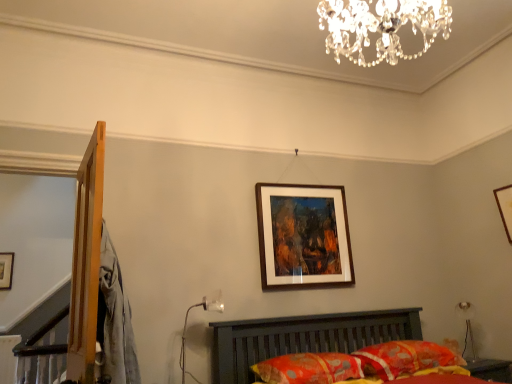
What do you see at coordinates (309, 368) in the screenshot? I see `floral fabric pillow at lower center, the 2th pillow in the right-to-left sequence` at bounding box center [309, 368].

The image size is (512, 384). I want to click on wooden picture frame at upper right, the 2th picture frame viewed from the back, so click(x=505, y=208).

Identify the location of wooden-framed painting at center, which ranks as the second picture frame in right-to-left order. Image resolution: width=512 pixels, height=384 pixels. (303, 235).

The width and height of the screenshot is (512, 384). Find the location of `metallic glass table lamp at lower center, which is the second table lamp from right to left`. metallic glass table lamp at lower center, which is the second table lamp from right to left is located at coordinates (205, 310).

Where is `wooden picture frame at upper center, the 3th picture frame in the front-to-back sequence`? wooden picture frame at upper center, the 3th picture frame in the front-to-back sequence is located at coordinates click(6, 270).

Is point (463, 350) closer to camera compared to point (5, 280)?

Yes, point (463, 350) is in front of point (5, 280).

Considering the relative positions of metallic silver table lamp at lower right, the first table lamp when ordered from back to front, and wooden picture frame at upper center, which ranks as the third picture frame in right-to-left order, in the image provided, is metallic silver table lamp at lower right, the first table lamp when ordered from back to front, in front of wooden picture frame at upper center, which ranks as the third picture frame in right-to-left order,?

Yes, it is.

Locate an element on the screen. the 2nd table lamp directly beneath the wooden picture frame at upper center, the 3th picture frame in the front-to-back sequence (from a real-world perspective) is located at coordinates (468, 329).

Do you think metallic silver table lamp at lower right, acting as the 2th table lamp starting from the front, is within wooden picture frame at upper center, the 3th picture frame in the front-to-back sequence, or outside of it?

metallic silver table lamp at lower right, acting as the 2th table lamp starting from the front, exists outside the volume of wooden picture frame at upper center, the 3th picture frame in the front-to-back sequence.

From a real-world perspective, is metallic glass table lamp at lower center, marked as the 1th table lamp in a front-to-back arrangement, physically below wooden picture frame at upper center, which ranks as the first picture frame in back-to-front order?

Correct, in the physical world, metallic glass table lamp at lower center, marked as the 1th table lamp in a front-to-back arrangement, is lower than wooden picture frame at upper center, which ranks as the first picture frame in back-to-front order.

Can you tell me how much metallic glass table lamp at lower center, marked as the 2th table lamp in a back-to-front arrangement, and wooden picture frame at upper center, the 1th picture frame positioned from the left, differ in facing direction?

9.87 degrees separate the facing orientations of metallic glass table lamp at lower center, marked as the 2th table lamp in a back-to-front arrangement, and wooden picture frame at upper center, the 1th picture frame positioned from the left.

Consider the image. Looking at their sizes, would you say metallic glass table lamp at lower center, which is the second table lamp from right to left, is wider or thinner than wooden picture frame at upper center, the 1th picture frame positioned from the left?

Considering their sizes, metallic glass table lamp at lower center, which is the second table lamp from right to left, looks broader than wooden picture frame at upper center, the 1th picture frame positioned from the left.

Is metallic glass table lamp at lower center, which is the second table lamp from right to left, at the left side of wooden picture frame at upper center, which ranks as the third picture frame in right-to-left order?

Incorrect, metallic glass table lamp at lower center, which is the second table lamp from right to left, is not on the left side of wooden picture frame at upper center, which ranks as the third picture frame in right-to-left order.

Is floral fabric pillow at lower center, arranged as the first pillow when viewed from the right, facing away from metallic silver table lamp at lower right, the first table lamp when ordered from back to front?

No.

Is floral fabric pillow at lower center, arranged as the second pillow when viewed from the left, located outside metallic silver table lamp at lower right, the 1th table lamp from the right?

Absolutely, floral fabric pillow at lower center, arranged as the second pillow when viewed from the left, is external to metallic silver table lamp at lower right, the 1th table lamp from the right.

From a real-world perspective, is floral fabric pillow at lower center, arranged as the second pillow when viewed from the left, positioned above or below metallic silver table lamp at lower right, the 1th table lamp from the right?

floral fabric pillow at lower center, arranged as the second pillow when viewed from the left, is situated lower than metallic silver table lamp at lower right, the 1th table lamp from the right, in the real world.

Which of these two, metallic silver table lamp at lower right, the first table lamp when ordered from back to front, or floral fabric pillow at lower center, the 2th pillow in the right-to-left sequence, stands taller?

metallic silver table lamp at lower right, the first table lamp when ordered from back to front, is taller.

Identify the location of the 1st table lamp directly above the floral fabric pillow at lower center, which is the 1th pillow from left to right (from a real-world perspective). This screenshot has width=512, height=384. (468, 329).

Considering the sizes of metallic silver table lamp at lower right, arranged as the second table lamp when viewed from the left, and floral fabric pillow at lower center, the 2th pillow in the right-to-left sequence, in the image, is metallic silver table lamp at lower right, arranged as the second table lamp when viewed from the left, bigger or smaller than floral fabric pillow at lower center, the 2th pillow in the right-to-left sequence,?

Considering their sizes, metallic silver table lamp at lower right, arranged as the second table lamp when viewed from the left, takes up less space than floral fabric pillow at lower center, the 2th pillow in the right-to-left sequence.

Looking at this image, which object is positioned more to the right, metallic silver table lamp at lower right, arranged as the second table lamp when viewed from the left, or floral fabric pillow at lower center, the 2th pillow in the right-to-left sequence?

From the viewer's perspective, metallic silver table lamp at lower right, arranged as the second table lamp when viewed from the left, appears more on the right side.

From a real-world perspective, between metallic glass table lamp at lower center, which is the second table lamp from right to left, and floral fabric pillow at lower center, arranged as the second pillow when viewed from the left, who is vertically higher?

In real-world perspective, metallic glass table lamp at lower center, which is the second table lamp from right to left, is above.

Considering the sizes of metallic glass table lamp at lower center, the first table lamp in the left-to-right sequence, and floral fabric pillow at lower center, arranged as the second pillow when viewed from the left, in the image, is metallic glass table lamp at lower center, the first table lamp in the left-to-right sequence, wider or thinner than floral fabric pillow at lower center, arranged as the second pillow when viewed from the left,?

Considering their sizes, metallic glass table lamp at lower center, the first table lamp in the left-to-right sequence, looks slimmer than floral fabric pillow at lower center, arranged as the second pillow when viewed from the left.

Is floral fabric pillow at lower center, arranged as the first pillow when viewed from the right, a part of metallic glass table lamp at lower center, marked as the 1th table lamp in a front-to-back arrangement?

Definitely not — floral fabric pillow at lower center, arranged as the first pillow when viewed from the right, is not inside metallic glass table lamp at lower center, marked as the 1th table lamp in a front-to-back arrangement.

From a real-world perspective, who is located higher, metallic glass table lamp at lower center, marked as the 2th table lamp in a back-to-front arrangement, or metallic silver table lamp at lower right, acting as the 2th table lamp starting from the front?

In real-world perspective, metallic glass table lamp at lower center, marked as the 2th table lamp in a back-to-front arrangement, is above.

Based on the photo, which is nearer, (183, 368) or (459, 302)?

The point (183, 368) is closer.

Considering the sizes of objects metallic glass table lamp at lower center, marked as the 2th table lamp in a back-to-front arrangement, and metallic silver table lamp at lower right, the first table lamp when ordered from back to front, in the image provided, who is taller, metallic glass table lamp at lower center, marked as the 2th table lamp in a back-to-front arrangement, or metallic silver table lamp at lower right, the first table lamp when ordered from back to front,?

metallic glass table lamp at lower center, marked as the 2th table lamp in a back-to-front arrangement.

What's the angular difference between metallic glass table lamp at lower center, the first table lamp in the left-to-right sequence, and metallic silver table lamp at lower right, the 1th table lamp from the right,'s facing directions?

They differ by 67.2 degrees in their facing directions.

Can you confirm if metallic glass table lamp at lower center, marked as the 2th table lamp in a back-to-front arrangement, is shorter than wooden-framed painting at center, which ranks as the second picture frame in right-to-left order?

Yes.

Image resolution: width=512 pixels, height=384 pixels. What are the coordinates of `table lamp that is the 1st one below the wooden-framed painting at center, placed as the third picture frame when sorted from back to front (from a real-world perspective)` in the screenshot? It's located at (205, 310).

In terms of width, does metallic glass table lamp at lower center, marked as the 1th table lamp in a front-to-back arrangement, look wider or thinner when compared to wooden-framed painting at center, acting as the 2th picture frame starting from the left?

Considering their sizes, metallic glass table lamp at lower center, marked as the 1th table lamp in a front-to-back arrangement, looks broader than wooden-framed painting at center, acting as the 2th picture frame starting from the left.

This screenshot has height=384, width=512. Find the location of `the 1st table lamp in front of the wooden picture frame at upper center, the 1th picture frame positioned from the left`. the 1st table lamp in front of the wooden picture frame at upper center, the 1th picture frame positioned from the left is located at coordinates (468, 329).

You are a GUI agent. You are given a task and a screenshot of the screen. Output one action in this format:
    pyautogui.click(x=<x>, y=<y>)
    Task: Click on the picture frame on the left of metallic glass table lamp at lower center, marked as the 1th table lamp in a front-to-back arrangement
    The height and width of the screenshot is (384, 512).
    Given the screenshot: What is the action you would take?
    pyautogui.click(x=6, y=270)

In the scene shown: When comparing their distances from floral fabric pillow at lower center, arranged as the first pillow when viewed from the right, does wooden-framed painting at center, placed as the third picture frame when sorted from back to front, or metallic silver table lamp at lower right, acting as the 2th table lamp starting from the front, seem further?

metallic silver table lamp at lower right, acting as the 2th table lamp starting from the front, lies further to floral fabric pillow at lower center, arranged as the first pillow when viewed from the right, than the other object.

When comparing their distances from wooden picture frame at upper right, which is the second picture frame from front to back, does wooden picture frame at upper center, the 1th picture frame positioned from the left, or wooden-framed painting at center, positioned as the 1th picture frame in front-to-back order, seem further?

The object further to wooden picture frame at upper right, which is the second picture frame from front to back, is wooden picture frame at upper center, the 1th picture frame positioned from the left.

Based on their spatial positions, is wooden-framed painting at center, acting as the 2th picture frame starting from the left, or wooden picture frame at upper center, which ranks as the first picture frame in back-to-front order, further from metallic glass table lamp at lower center, marked as the 1th table lamp in a front-to-back arrangement?

wooden picture frame at upper center, which ranks as the first picture frame in back-to-front order, lies further to metallic glass table lamp at lower center, marked as the 1th table lamp in a front-to-back arrangement, than the other object.

Which object lies nearer to the anchor point wooden-framed painting at center, positioned as the 1th picture frame in front-to-back order, wooden picture frame at upper right, which is the second picture frame from front to back, or metallic glass table lamp at lower center, the first table lamp in the left-to-right sequence?

metallic glass table lamp at lower center, the first table lamp in the left-to-right sequence.

From the picture: Which object lies nearer to the anchor point wooden picture frame at upper center, which ranks as the first picture frame in back-to-front order, metallic glass table lamp at lower center, which is the second table lamp from right to left, or floral fabric pillow at lower center, the 2th pillow in the right-to-left sequence?

metallic glass table lamp at lower center, which is the second table lamp from right to left.

Based on their spatial positions, is floral fabric pillow at lower center, arranged as the first pillow when viewed from the right, or metallic glass table lamp at lower center, the first table lamp in the left-to-right sequence, closer to floral fabric pillow at lower center, which is the 1th pillow from left to right?

The object closer to floral fabric pillow at lower center, which is the 1th pillow from left to right, is floral fabric pillow at lower center, arranged as the first pillow when viewed from the right.

Considering their positions, is metallic silver table lamp at lower right, acting as the 2th table lamp starting from the front, positioned further to floral fabric pillow at lower center, the 2th pillow in the right-to-left sequence, than metallic glass table lamp at lower center, marked as the 2th table lamp in a back-to-front arrangement?

The object further to floral fabric pillow at lower center, the 2th pillow in the right-to-left sequence, is metallic silver table lamp at lower right, acting as the 2th table lamp starting from the front.

Considering their positions, is metallic glass table lamp at lower center, marked as the 1th table lamp in a front-to-back arrangement, positioned further to floral fabric pillow at lower center, arranged as the first pillow when viewed from the right, than wooden picture frame at upper right, the 2th picture frame viewed from the back?

wooden picture frame at upper right, the 2th picture frame viewed from the back, is further to floral fabric pillow at lower center, arranged as the first pillow when viewed from the right.

Identify the location of table lamp between wooden picture frame at upper center, which ranks as the first picture frame in back-to-front order, and floral fabric pillow at lower center, which is the 1th pillow from left to right, from left to right. The height and width of the screenshot is (384, 512). (205, 310).

Identify the location of pillow between wooden picture frame at upper center, which ranks as the first picture frame in back-to-front order, and wooden-framed painting at center, placed as the third picture frame when sorted from back to front, in the horizontal direction. Image resolution: width=512 pixels, height=384 pixels. (309, 368).

Image resolution: width=512 pixels, height=384 pixels. I want to click on picture frame between wooden picture frame at upper center, which ranks as the first picture frame in back-to-front order, and floral fabric pillow at lower center, arranged as the first pillow when viewed from the right, in the horizontal direction, so click(x=303, y=235).

You are a GUI agent. You are given a task and a screenshot of the screen. Output one action in this format:
    pyautogui.click(x=<x>, y=<y>)
    Task: Click on the picture frame between wooden picture frame at upper center, which ranks as the first picture frame in back-to-front order, and metallic silver table lamp at lower right, acting as the 2th table lamp starting from the front, in the horizontal direction
    
    Given the screenshot: What is the action you would take?
    pyautogui.click(x=303, y=235)